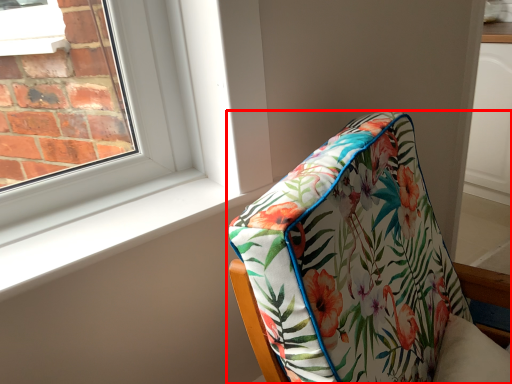
Question: Considering the relative positions of furniture (annotated by the red box) and window sill in the image provided, where is furniture (annotated by the red box) located with respect to the staircase?

Choices:
 (A) left
 (B) right

Answer: (B)